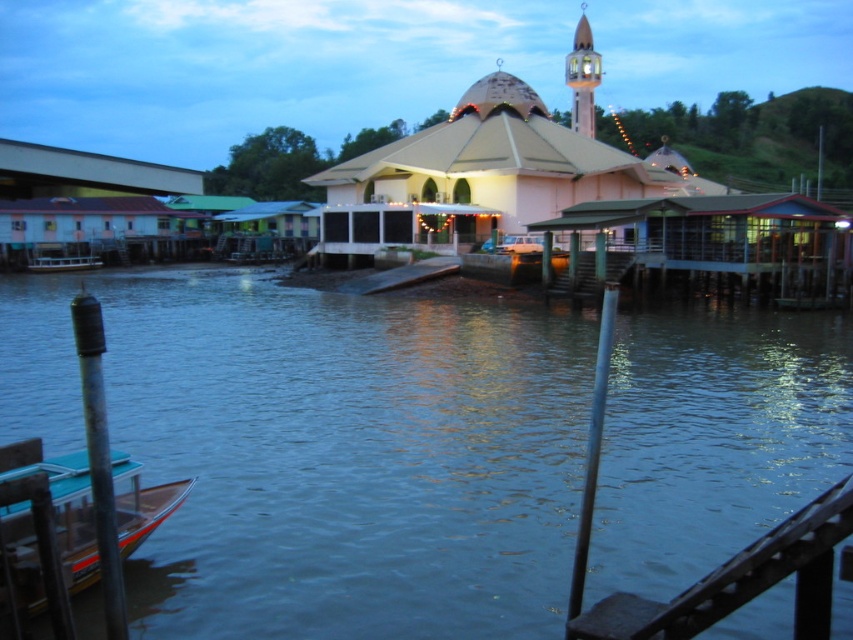
Who is positioned more to the right, wooden dock at right or light brown wooden minaret at upper right?

From the viewer's perspective, light brown wooden minaret at upper right appears more on the right side.

Which is in front, point (566, 284) or point (589, 97)?

Point (566, 284) is in front.

The image size is (853, 640). In order to click on wooden dock at right in this screenshot , I will do `click(726, 244)`.

Can you confirm if clear water at center is positioned above wooden dock at right?

Incorrect, clear water at center is not positioned above wooden dock at right.

What do you see at coordinates (323, 449) in the screenshot?
I see `clear water at center` at bounding box center [323, 449].

Is point (646, 380) in front of point (534, 221)?

Yes.

The image size is (853, 640). I want to click on clear water at center, so click(x=323, y=449).

Can you confirm if clear water at center is positioned to the left of teal plastic boat at lower left?

Correct, you'll find clear water at center to the left of teal plastic boat at lower left.

Does point (383, 566) come behind point (129, 513)?

Yes, it is.

Does point (555, 308) come in front of point (128, 536)?

No.

You are a GUI agent. You are given a task and a screenshot of the screen. Output one action in this format:
    pyautogui.click(x=<x>, y=<y>)
    Task: Click on the clear water at center
    The image size is (853, 640).
    Given the screenshot: What is the action you would take?
    pyautogui.click(x=323, y=449)